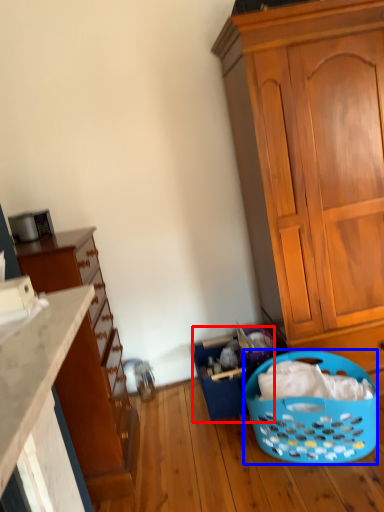
Question: Which object appears closest to the camera in this image, basket (highlighted by a red box) or picnic basket (highlighted by a blue box)?

Choices:
 (A) basket
 (B) picnic basket

Answer: (B)